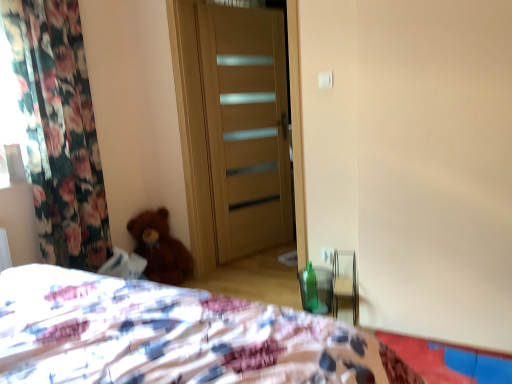
Question: Is brown plush teddy bear at lower left touching green glass bottle at lower right?

Choices:
 (A) no
 (B) yes

Answer: (A)

Question: Does brown plush teddy bear at lower left come in front of green glass bottle at lower right?

Choices:
 (A) yes
 (B) no

Answer: (B)

Question: Is brown plush teddy bear at lower left surrounding green glass bottle at lower right?

Choices:
 (A) no
 (B) yes

Answer: (A)

Question: Is brown plush teddy bear at lower left positioned with its back to green glass bottle at lower right?

Choices:
 (A) yes
 (B) no

Answer: (B)

Question: From the image's perspective, is brown plush teddy bear at lower left below green glass bottle at lower right?

Choices:
 (A) yes
 (B) no

Answer: (B)

Question: Considering the positions of brown plush teddy bear at lower left and light brown wood door at center in the image, is brown plush teddy bear at lower left taller or shorter than light brown wood door at center?

Choices:
 (A) short
 (B) tall

Answer: (A)

Question: Is brown plush teddy bear at lower left in front of or behind light brown wood door at center in the image?

Choices:
 (A) front
 (B) behind

Answer: (A)

Question: Is brown plush teddy bear at lower left bigger or smaller than light brown wood door at center?

Choices:
 (A) big
 (B) small

Answer: (B)

Question: From a real-world perspective, is brown plush teddy bear at lower left above or below light brown wood door at center?

Choices:
 (A) below
 (B) above

Answer: (A)

Question: In the image, is light brown wood door at center on the left side or the right side of green glass bottle at lower right?

Choices:
 (A) left
 (B) right

Answer: (A)

Question: In terms of width, does light brown wood door at center look wider or thinner when compared to green glass bottle at lower right?

Choices:
 (A) thin
 (B) wide

Answer: (B)

Question: Based on their sizes in the image, would you say light brown wood door at center is bigger or smaller than green glass bottle at lower right?

Choices:
 (A) big
 (B) small

Answer: (A)

Question: Do you think light brown wood door at center is within green glass bottle at lower right, or outside of it?

Choices:
 (A) outside
 (B) inside

Answer: (A)

Question: In the image, is light brown wood door at center positioned in front of or behind brown plush teddy bear at lower left?

Choices:
 (A) front
 (B) behind

Answer: (B)

Question: Is point (260, 210) positioned closer to the camera than point (177, 254)?

Choices:
 (A) closer
 (B) farther

Answer: (B)